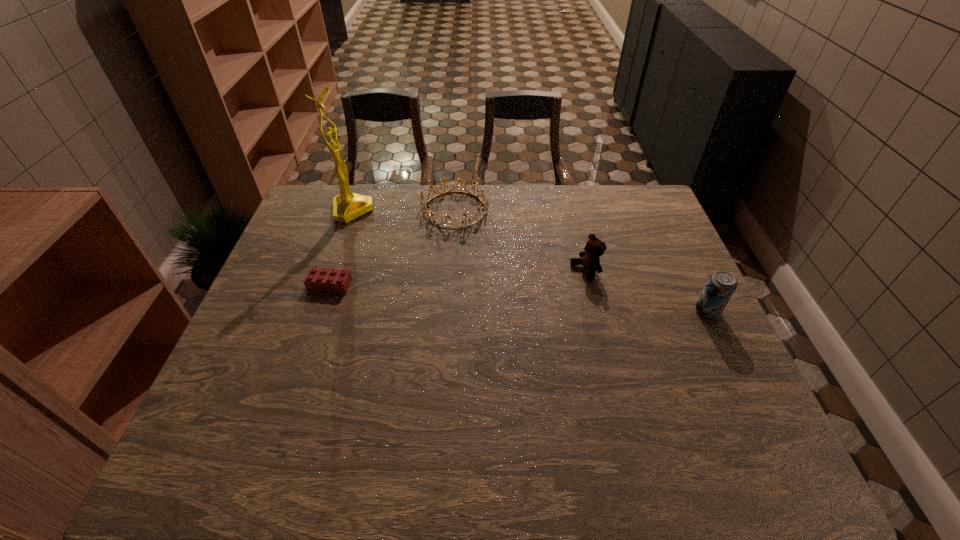
The image size is (960, 540). What are the coordinates of `Lego` in the screenshot? It's located at (318, 279).

At what (x,y) coordinates should I click in order to perform the action: click on the rightmost object. Please return your answer as a coordinate pair (x, y). Looking at the image, I should click on (721, 285).

The width and height of the screenshot is (960, 540). What are the coordinates of `the nearest object` in the screenshot? It's located at (721, 285).

Where is `tiara`? The image size is (960, 540). tiara is located at coordinates (485, 203).

Find the location of a particular element. The image size is (960, 540). the fourth tallest object is located at coordinates (485, 203).

Locate an element on the screen. The width and height of the screenshot is (960, 540). teddy bear is located at coordinates (594, 248).

Locate an element on the screen. This screenshot has height=540, width=960. award is located at coordinates click(x=347, y=206).

Find the location of a particular element. Image resolution: width=960 pixels, height=540 pixels. free spot located on the right of the shortest object is located at coordinates (470, 285).

Locate an element on the screen. The width and height of the screenshot is (960, 540). vacant point located 0.370m on the back of the nearest object is located at coordinates (662, 218).

The width and height of the screenshot is (960, 540). Find the location of `free location located 0.370m on the front-facing side of the tiara`. free location located 0.370m on the front-facing side of the tiara is located at coordinates (516, 312).